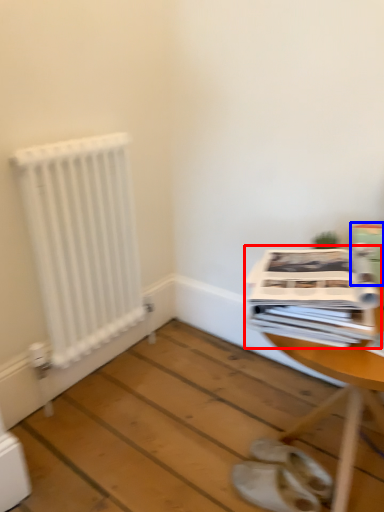
Question: Which point is further to the camera, magazine (highlighted by a red box) or cardboard box (highlighted by a blue box)?

Choices:
 (A) magazine
 (B) cardboard box

Answer: (B)